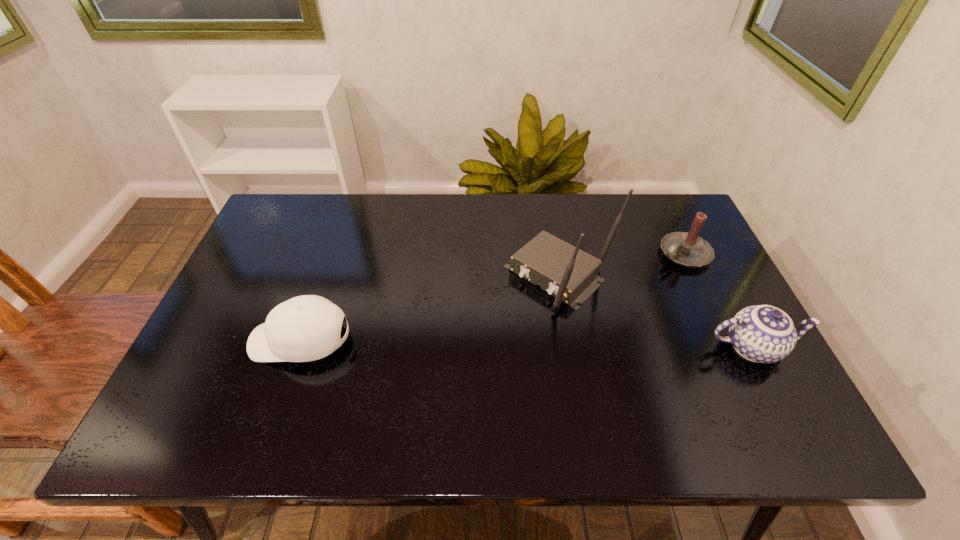
Image resolution: width=960 pixels, height=540 pixels. In order to click on free space between the tallest object and the chinaware in this screenshot , I will do `click(655, 312)`.

At what (x,y) coordinates should I click in order to perform the action: click on the closest object relative to the baseball cap. Please return your answer as a coordinate pair (x, y). This screenshot has width=960, height=540. Looking at the image, I should click on (570, 275).

Locate an element on the screen. object identified as the closest to the second object from left to right is located at coordinates (688, 249).